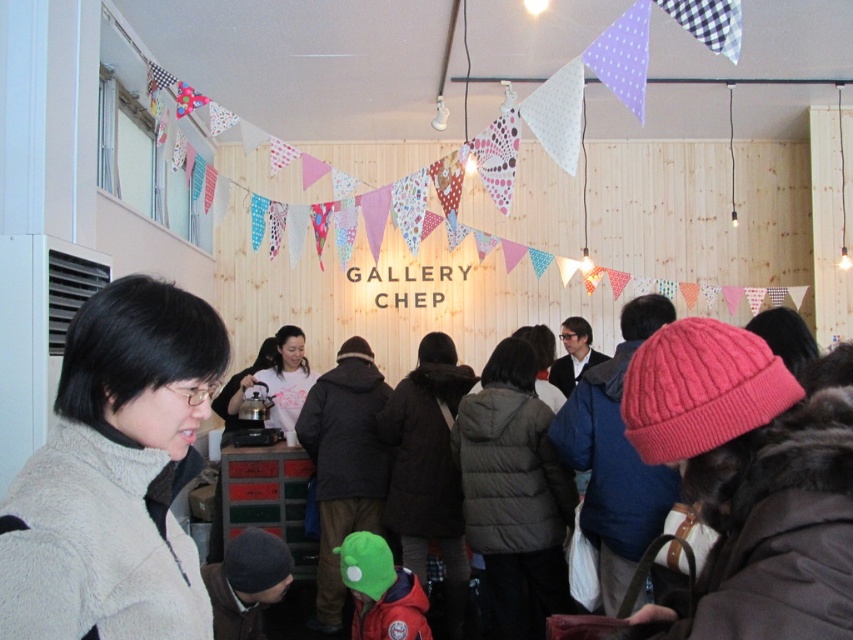
Question: Which of the following is the closest to the observer?

Choices:
 (A) dark gray puffer jacket at center
 (B) gray fleece jacket at lower left
 (C) dark brown fur coat at center

Answer: (B)

Question: Can you confirm if dark gray puffer jacket at center is thinner than white matte shirt at center?

Choices:
 (A) no
 (B) yes

Answer: (B)

Question: Estimate the real-world distances between objects in this image. Which object is farther from the gray fleece jacket at lower left?

Choices:
 (A) white matte shirt at center
 (B) dark gray puffer jacket at center

Answer: (A)

Question: Does gray fleece jacket at lower left appear over dark gray puffer jacket at center?

Choices:
 (A) yes
 (B) no

Answer: (A)

Question: Which point appears farthest from the camera in this image?

Choices:
 (A) (233, 410)
 (B) (200, 396)
 (C) (529, 632)

Answer: (A)

Question: Does dark gray puffer jacket at center come in front of white matte shirt at center?

Choices:
 (A) no
 (B) yes

Answer: (B)